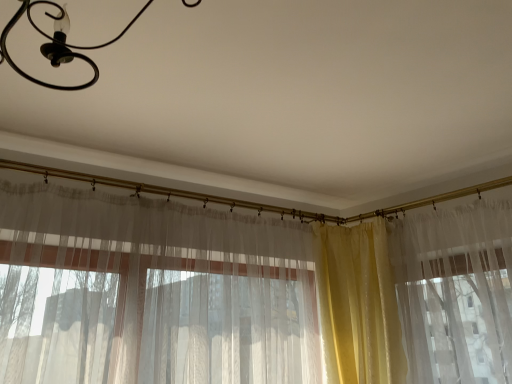
I want to click on translucent fabric curtain at center, which is the 2th curtain in right-to-left order, so click(152, 292).

This screenshot has width=512, height=384. In order to click on translucent fabric curtain at center, which is the first curtain in left-to-right order in this screenshot , I will do `click(152, 292)`.

Which is more to the left, translucent fabric curtain at center, which is the 2th curtain in right-to-left order, or black matte chandelier at upper left?

black matte chandelier at upper left.

How much distance is there between translucent fabric curtain at center, which is the 2th curtain in right-to-left order, and black matte chandelier at upper left?

The distance of translucent fabric curtain at center, which is the 2th curtain in right-to-left order, from black matte chandelier at upper left is 3.63 feet.

Identify the location of light fixture positioned vertically above the translucent fabric curtain at center, which is the 2th curtain in right-to-left order (from a real-world perspective). (57, 43).

What's the angular difference between translucent fabric curtain at center, which is the 2th curtain in right-to-left order, and black matte chandelier at upper left's facing directions?

2.05 degrees separate the facing orientations of translucent fabric curtain at center, which is the 2th curtain in right-to-left order, and black matte chandelier at upper left.

Based on their positions, is black matte chandelier at upper left located to the left or right of translucent fabric curtain at center, which is the 2th curtain in right-to-left order?

Clearly, black matte chandelier at upper left is on the left of translucent fabric curtain at center, which is the 2th curtain in right-to-left order, in the image.

Is black matte chandelier at upper left wider than translucent fabric curtain at center, which is the first curtain in left-to-right order?

Indeed, black matte chandelier at upper left has a greater width compared to translucent fabric curtain at center, which is the first curtain in left-to-right order.

Is point (9, 26) farther from camera compared to point (10, 271)?

No, (9, 26) is in front of (10, 271).

From a real-world perspective, is black matte chandelier at upper left on top of translucent fabric curtain at center, which is the first curtain in left-to-right order?

Answer: Yes.

From the image's perspective, is yellow satin curtain at right, which is the second curtain from left to right, on translucent fabric curtain at center, which is the first curtain in left-to-right order?

No, from the image's perspective, yellow satin curtain at right, which is the second curtain from left to right, is not above translucent fabric curtain at center, which is the first curtain in left-to-right order.

Which of these two, yellow satin curtain at right, which is the 1th curtain from right to left, or translucent fabric curtain at center, which is the 2th curtain in right-to-left order, is bigger?

Bigger between the two is translucent fabric curtain at center, which is the 2th curtain in right-to-left order.

Can you confirm if yellow satin curtain at right, which is the second curtain from left to right, is shorter than translucent fabric curtain at center, which is the 2th curtain in right-to-left order?

Correct, yellow satin curtain at right, which is the second curtain from left to right, is not as tall as translucent fabric curtain at center, which is the 2th curtain in right-to-left order.

From the image's perspective, is black matte chandelier at upper left positioned above or below yellow satin curtain at right, which is the second curtain from left to right?

Based on their image positions, black matte chandelier at upper left is located above yellow satin curtain at right, which is the second curtain from left to right.

From a real-world perspective, which is physically below, black matte chandelier at upper left or yellow satin curtain at right, which is the second curtain from left to right?

From a 3D spatial view, yellow satin curtain at right, which is the second curtain from left to right, is below.

How many degrees apart are the facing directions of black matte chandelier at upper left and yellow satin curtain at right, which is the second curtain from left to right?

They differ by 49.5 degrees in their facing directions.

Between yellow satin curtain at right, which is the second curtain from left to right, and black matte chandelier at upper left, which one has more height?

With more height is yellow satin curtain at right, which is the second curtain from left to right.

You are a GUI agent. You are given a task and a screenshot of the screen. Output one action in this format:
    pyautogui.click(x=<x>, y=<y>)
    Task: Click on the light fixture that appears above the yellow satin curtain at right, which is the 1th curtain from right to left (from the image's perspective)
    The height and width of the screenshot is (384, 512).
    Given the screenshot: What is the action you would take?
    pyautogui.click(x=57, y=43)

From the image's perspective, which one is positioned lower, yellow satin curtain at right, which is the second curtain from left to right, or black matte chandelier at upper left?

yellow satin curtain at right, which is the second curtain from left to right, appears lower in the image.

Is point (4, 222) positioned after point (342, 271)?

No, (4, 222) is in front of (342, 271).

Is the depth of translucent fabric curtain at center, which is the 2th curtain in right-to-left order, less than that of yellow satin curtain at right, which is the second curtain from left to right?

That is True.

Is there a large distance between translucent fabric curtain at center, which is the 2th curtain in right-to-left order, and yellow satin curtain at right, which is the 1th curtain from right to left?

Actually, translucent fabric curtain at center, which is the 2th curtain in right-to-left order, and yellow satin curtain at right, which is the 1th curtain from right to left, are a little close together.

From a real-world perspective, between translucent fabric curtain at center, which is the first curtain in left-to-right order, and yellow satin curtain at right, which is the second curtain from left to right, who is vertically higher?

translucent fabric curtain at center, which is the first curtain in left-to-right order, is physically above.

What are the coordinates of `curtain that is the 1st object directly below the black matte chandelier at upper left (from a real-world perspective)` in the screenshot? It's located at (152, 292).

Which curtain is the 1st one when counting from the right side of the black matte chandelier at upper left? Please provide its 2D coordinates.

[(152, 292)]

When comparing their distances from black matte chandelier at upper left, does yellow satin curtain at right, which is the 1th curtain from right to left, or translucent fabric curtain at center, which is the 2th curtain in right-to-left order, seem further?

yellow satin curtain at right, which is the 1th curtain from right to left, is further to black matte chandelier at upper left.

When comparing their distances from yellow satin curtain at right, which is the second curtain from left to right, does translucent fabric curtain at center, which is the 2th curtain in right-to-left order, or black matte chandelier at upper left seem closer?

translucent fabric curtain at center, which is the 2th curtain in right-to-left order.

Considering their positions, is yellow satin curtain at right, which is the second curtain from left to right, positioned further to translucent fabric curtain at center, which is the first curtain in left-to-right order, than black matte chandelier at upper left?

Among the two, black matte chandelier at upper left is located further to translucent fabric curtain at center, which is the first curtain in left-to-right order.

Estimate the real-world distances between objects in this image. Which object is further from yellow satin curtain at right, which is the 1th curtain from right to left, black matte chandelier at upper left or translucent fabric curtain at center, which is the 2th curtain in right-to-left order?

black matte chandelier at upper left.

Which object lies further to the anchor point black matte chandelier at upper left, translucent fabric curtain at center, which is the first curtain in left-to-right order, or yellow satin curtain at right, which is the second curtain from left to right?

yellow satin curtain at right, which is the second curtain from left to right, is further to black matte chandelier at upper left.

When comparing their distances from translucent fabric curtain at center, which is the 2th curtain in right-to-left order, does black matte chandelier at upper left or yellow satin curtain at right, which is the 1th curtain from right to left, seem closer?

Among the two, yellow satin curtain at right, which is the 1th curtain from right to left, is located nearer to translucent fabric curtain at center, which is the 2th curtain in right-to-left order.

Where is `curtain between black matte chandelier at upper left and yellow satin curtain at right, which is the 1th curtain from right to left, along the z-axis`? curtain between black matte chandelier at upper left and yellow satin curtain at right, which is the 1th curtain from right to left, along the z-axis is located at coordinates (152, 292).